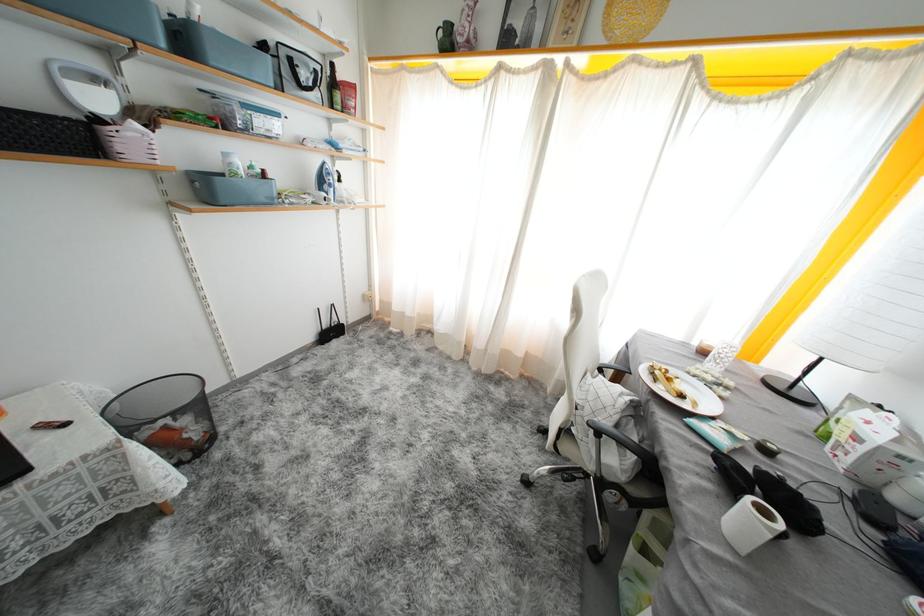
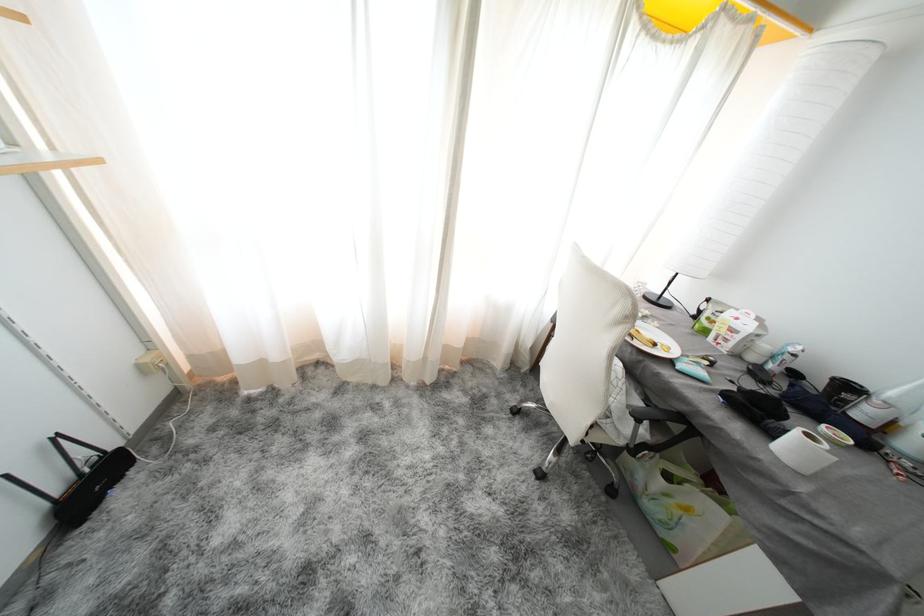
The first image is from the beginning of the video and the second image is from the end. How did the camera likely rotate when shooting the video?

The camera's rotation is toward right-down.